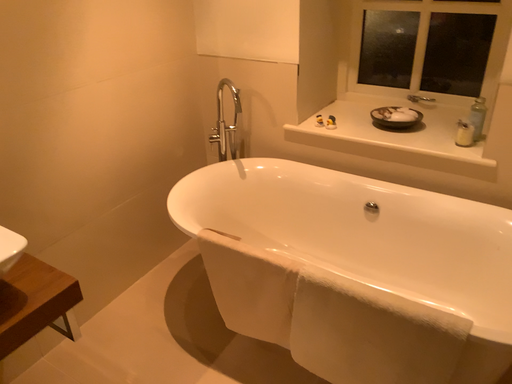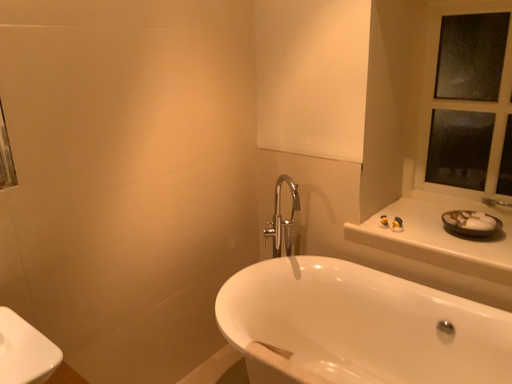
Question: How did the camera likely rotate when shooting the video?

Choices:
 (A) rotated right
 (B) rotated left

Answer: (B)